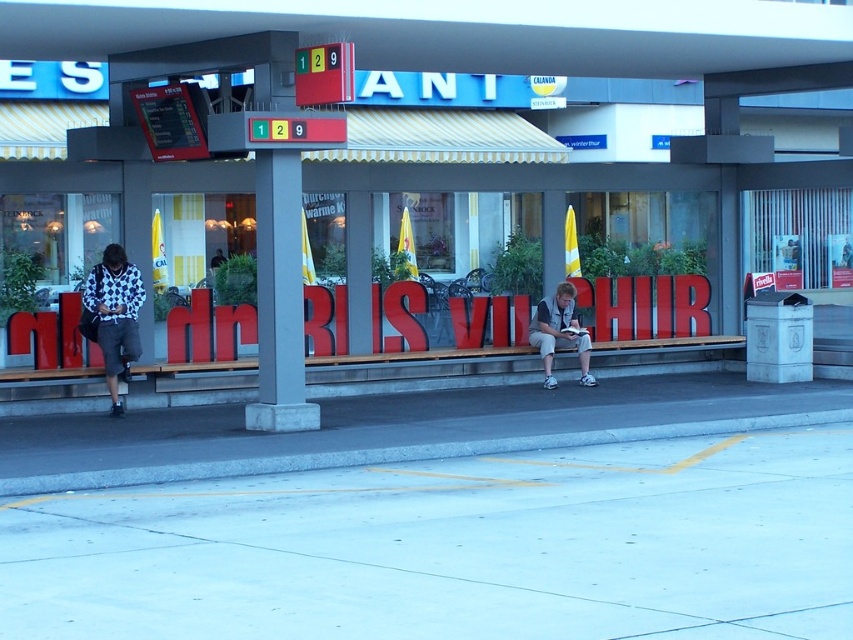
Does patterned fabric jacket at left have a smaller size compared to light gray fabric jacket at center?

Yes.

Who is more forward, (120,268) or (564,332)?

Point (120,268)

This screenshot has width=853, height=640. What do you see at coordinates (115, 316) in the screenshot?
I see `patterned fabric jacket at left` at bounding box center [115, 316].

Identify the location of patterned fabric jacket at left. (115, 316).

Locate an element on the screen. gray concrete pavement at lower center is located at coordinates (456, 548).

Is point (103, 636) less distant than point (132, 276)?

Yes, point (103, 636) is closer to viewer.

You are a GUI agent. You are given a task and a screenshot of the screen. Output one action in this format:
    pyautogui.click(x=<x>, y=<y>)
    Task: Click on the gray concrete pavement at lower center
    Image resolution: width=853 pixels, height=640 pixels.
    Given the screenshot: What is the action you would take?
    pyautogui.click(x=456, y=548)

From the picture: Does wooden bench at center come in front of patterned fabric jacket at left?

That is False.

Who is positioned more to the right, wooden bench at center or patterned fabric jacket at left?

Positioned to the right is wooden bench at center.

Find the location of a particular element. The height and width of the screenshot is (640, 853). wooden bench at center is located at coordinates (418, 372).

Where is `wooden bench at center`? The height and width of the screenshot is (640, 853). wooden bench at center is located at coordinates (x=418, y=372).